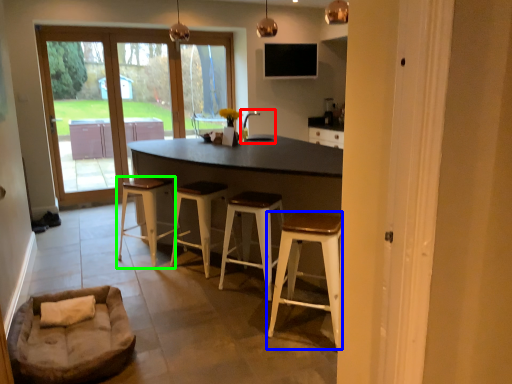
Question: Considering the real-world distances, which object is farthest from sink (highlighted by a red box)? stool (highlighted by a blue box) or stool (highlighted by a green box)?

Choices:
 (A) stool
 (B) stool

Answer: (A)